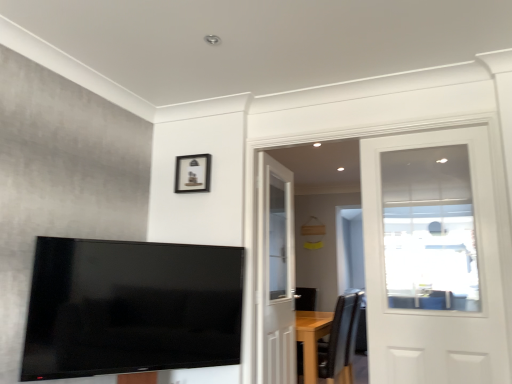
This screenshot has height=384, width=512. I want to click on white wooden door at center, which is counted as the 1th door, starting from the back, so click(x=275, y=274).

Based on their sizes in the image, would you say white wooden door at center, which is counted as the first door, starting from the left, is bigger or smaller than flat screen tv at lower left?

white wooden door at center, which is counted as the first door, starting from the left, is bigger than flat screen tv at lower left.

Considering the points (290, 320) and (136, 295), which point is in front, point (290, 320) or point (136, 295)?

The point (136, 295) is closer.

Based on the photo, is white wooden door at center, the 2th door in the right-to-left sequence, facing towards flat screen tv at lower left?

No, white wooden door at center, the 2th door in the right-to-left sequence, is not aimed at flat screen tv at lower left.

Starting from the matte black picture frame at upper center, which door is the 2nd one in front? Please provide its 2D coordinates.

[(435, 259)]

Is point (465, 144) closer to viewer compared to point (187, 168)?

That is True.

From a real-world perspective, which object rests below the other?

white glossy door at upper right, which is the 1th door from front to back, from a real-world perspective.

Does flat screen tv at lower left appear on the left side of matte black picture frame at upper center?

Yes.

Looking at the image, does flat screen tv at lower left seem bigger or smaller compared to matte black picture frame at upper center?

In the image, flat screen tv at lower left appears to be larger than matte black picture frame at upper center.

Would you say flat screen tv at lower left is a long distance from matte black picture frame at upper center?

That's not correct — flat screen tv at lower left is a little close to matte black picture frame at upper center.

Which of these two, flat screen tv at lower left or matte black picture frame at upper center, is wider?

Wider between the two is flat screen tv at lower left.

Does matte black picture frame at upper center have a lesser width compared to flat screen tv at lower left?

Yes.

Is matte black picture frame at upper center turned away from flat screen tv at lower left?

That's not correct — matte black picture frame at upper center is not looking away from flat screen tv at lower left.

From the image's perspective, would you say matte black picture frame at upper center is shown under flat screen tv at lower left?

No, from the image's perspective, matte black picture frame at upper center is not beneath flat screen tv at lower left.

Is point (191, 156) positioned behind point (224, 321)?

Yes, point (191, 156) is farther from viewer.

Can you tell me how much white glossy door at upper right, which is the 1th door from front to back, and black leather chair at lower right differ in facing direction?

white glossy door at upper right, which is the 1th door from front to back, and black leather chair at lower right are facing 90.3 degrees away from each other.

How far apart are white glossy door at upper right, which is the 1th door from front to back, and black leather chair at lower right?

The distance of white glossy door at upper right, which is the 1th door from front to back, from black leather chair at lower right is 6.87 feet.

Is white glossy door at upper right, the second door when ordered from left to right, positioned with its back to black leather chair at lower right?

No, white glossy door at upper right, the second door when ordered from left to right, is not facing the opposite direction of black leather chair at lower right.

Would you say white glossy door at upper right, positioned as the first door in right-to-left order, contains black leather chair at lower right?

No, black leather chair at lower right is not surrounded by white glossy door at upper right, positioned as the first door in right-to-left order.

In the image, is black leather chair at lower right on the left side or the right side of white wooden door at center, which is counted as the first door, starting from the left?

Clearly, black leather chair at lower right is on the right of white wooden door at center, which is counted as the first door, starting from the left, in the image.

Looking at this image, is black leather chair at lower right outside of white wooden door at center, the 2th door in the right-to-left sequence?

Indeed, black leather chair at lower right is completely outside white wooden door at center, the 2th door in the right-to-left sequence.

Is black leather chair at lower right next to white wooden door at center, the 2th door in the right-to-left sequence?

black leather chair at lower right and white wooden door at center, the 2th door in the right-to-left sequence, are not in contact.

Who is shorter, black leather chair at lower right or white wooden door at center, positioned as the 2th door in front-to-back order?

→ With less height is black leather chair at lower right.

Considering the relative sizes of white glossy door at upper right, the second door when ordered from left to right, and white wooden door at center, the 2th door in the right-to-left sequence, in the image provided, is white glossy door at upper right, the second door when ordered from left to right, smaller than white wooden door at center, the 2th door in the right-to-left sequence,?

Yes, white glossy door at upper right, the second door when ordered from left to right, is smaller than white wooden door at center, the 2th door in the right-to-left sequence.

Between white glossy door at upper right, which is the 1th door from front to back, and white wooden door at center, which is counted as the 1th door, starting from the back, which one has less height?

white glossy door at upper right, which is the 1th door from front to back, is shorter.

From a real-world perspective, is white glossy door at upper right, arranged as the 2th door when viewed from the back, located higher than white wooden door at center, positioned as the 2th door in front-to-back order?

Indeed, from a real-world perspective, white glossy door at upper right, arranged as the 2th door when viewed from the back, stands above white wooden door at center, positioned as the 2th door in front-to-back order.

You are a GUI agent. You are given a task and a screenshot of the screen. Output one action in this format:
    pyautogui.click(x=<x>, y=<y>)
    Task: Click on the door above the white wooden door at center, which is counted as the 1th door, starting from the back (from a real-world perspective)
    The height and width of the screenshot is (384, 512).
    Given the screenshot: What is the action you would take?
    point(435,259)

Where is `the 2nd door behind the flat screen tv at lower left`? the 2nd door behind the flat screen tv at lower left is located at coordinates (275, 274).

The image size is (512, 384). Find the location of `door that is the 2nd one when counting forward from the matte black picture frame at upper center`. door that is the 2nd one when counting forward from the matte black picture frame at upper center is located at coordinates (435, 259).

From the image, which object appears to be farther from black leather chair at lower right, white wooden door at center, positioned as the 2th door in front-to-back order, or matte black picture frame at upper center?

The object further to black leather chair at lower right is matte black picture frame at upper center.

Looking at the image, which one is located further to flat screen tv at lower left, black leather chair at lower right or white glossy door at upper right, the second door when ordered from left to right?

white glossy door at upper right, the second door when ordered from left to right, lies further to flat screen tv at lower left than the other object.

From the image, which object appears to be nearer to matte black picture frame at upper center, white wooden door at center, which is counted as the first door, starting from the left, or white glossy door at upper right, positioned as the first door in right-to-left order?

The object closer to matte black picture frame at upper center is white wooden door at center, which is counted as the first door, starting from the left.

Looking at the image, which one is located further to matte black picture frame at upper center, black leather chair at lower right or white wooden door at center, positioned as the 2th door in front-to-back order?

The object further to matte black picture frame at upper center is black leather chair at lower right.

From the image, which object appears to be nearer to white glossy door at upper right, the second door when ordered from left to right, matte black picture frame at upper center or flat screen tv at lower left?

matte black picture frame at upper center is closer to white glossy door at upper right, the second door when ordered from left to right.

Considering their positions, is white glossy door at upper right, the second door when ordered from left to right, positioned closer to white wooden door at center, which is counted as the 1th door, starting from the back, than black leather chair at lower right?

Based on the image, black leather chair at lower right appears to be nearer to white wooden door at center, which is counted as the 1th door, starting from the back.

Considering their positions, is white wooden door at center, which is counted as the first door, starting from the left, positioned further to white glossy door at upper right, the second door when ordered from left to right, than black leather chair at lower right?

Among the two, white wooden door at center, which is counted as the first door, starting from the left, is located further to white glossy door at upper right, the second door when ordered from left to right.

Looking at the image, which one is located further to flat screen tv at lower left, white wooden door at center, the 2th door in the right-to-left sequence, or black leather chair at lower right?

black leather chair at lower right is further to flat screen tv at lower left.

Locate an element on the screen. The image size is (512, 384). door between flat screen tv at lower left and white glossy door at upper right, the second door when ordered from left to right is located at coordinates click(x=275, y=274).

This screenshot has width=512, height=384. I want to click on door between white glossy door at upper right, positioned as the first door in right-to-left order, and black leather chair at lower right, along the z-axis, so click(275, 274).

I want to click on picture frame positioned between white glossy door at upper right, positioned as the first door in right-to-left order, and black leather chair at lower right from near to far, so click(192, 173).

Locate an element on the screen. This screenshot has width=512, height=384. picture frame positioned between flat screen tv at lower left and black leather chair at lower right from near to far is located at coordinates (192, 173).